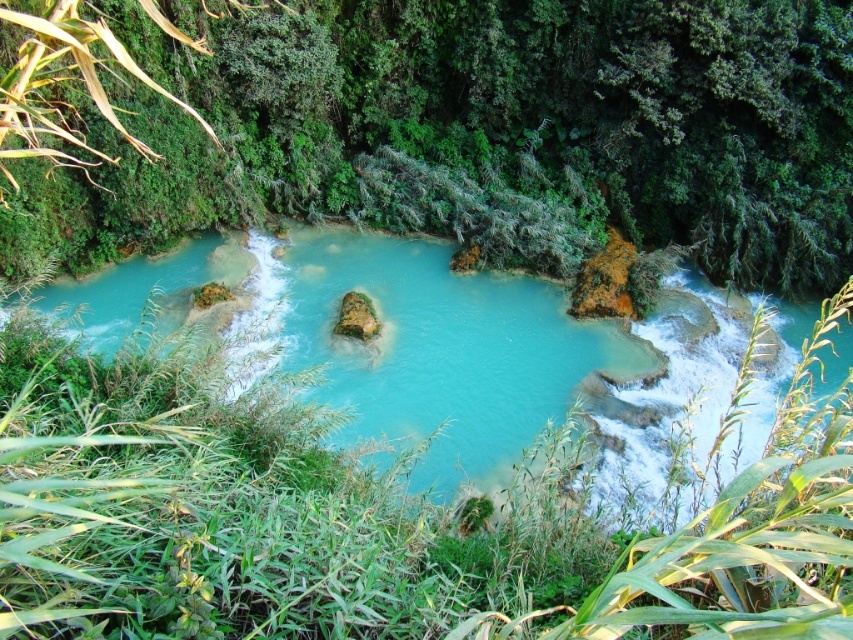
Question: Which point is closer to the camera?

Choices:
 (A) turquoise glossy water at center
 (B) green leafy vegetation at center

Answer: (B)

Question: Among these objects, which one is nearest to the camera?

Choices:
 (A) green leafy vegetation at center
 (B) turquoise glossy water at center

Answer: (A)

Question: Can you confirm if green leafy vegetation at center is wider than turquoise glossy water at center?

Choices:
 (A) no
 (B) yes

Answer: (B)

Question: Can you confirm if green leafy vegetation at center is positioned to the right of turquoise glossy water at center?

Choices:
 (A) no
 (B) yes

Answer: (B)

Question: Does green leafy vegetation at center appear over turquoise glossy water at center?

Choices:
 (A) no
 (B) yes

Answer: (B)